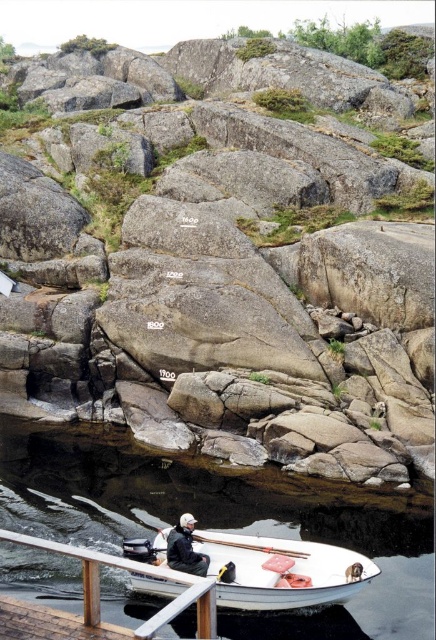
Does clear water at lower center have a greater height compared to dark gray fabric jacket at lower center?

Yes, clear water at lower center is taller than dark gray fabric jacket at lower center.

Is point (406, 632) positioned in front of point (200, 572)?

Yes, it is.

Locate an element on the screen. This screenshot has height=640, width=436. clear water at lower center is located at coordinates [220, 525].

Locate an element on the screen. This screenshot has width=436, height=640. clear water at lower center is located at coordinates (220, 525).

Which is more to the left, clear water at lower center or white wooden rail at lower center?

From the viewer's perspective, white wooden rail at lower center appears more on the left side.

Which of these two, clear water at lower center or white wooden rail at lower center, stands shorter?

With less height is white wooden rail at lower center.

Where is `clear water at lower center`? Image resolution: width=436 pixels, height=640 pixels. clear water at lower center is located at coordinates (220, 525).

Who is lower down, clear water at lower center or white matte boat at lower center?

white matte boat at lower center is below.

Does clear water at lower center have a lesser height compared to white matte boat at lower center?

Incorrect, clear water at lower center's height does not fall short of white matte boat at lower center's.

Find the location of a particular element. This screenshot has width=436, height=640. clear water at lower center is located at coordinates (220, 525).